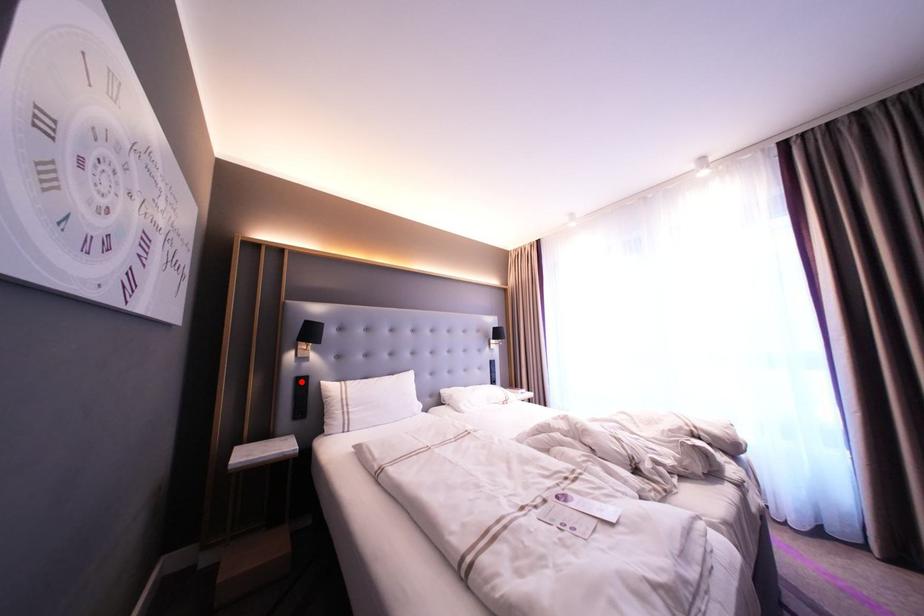
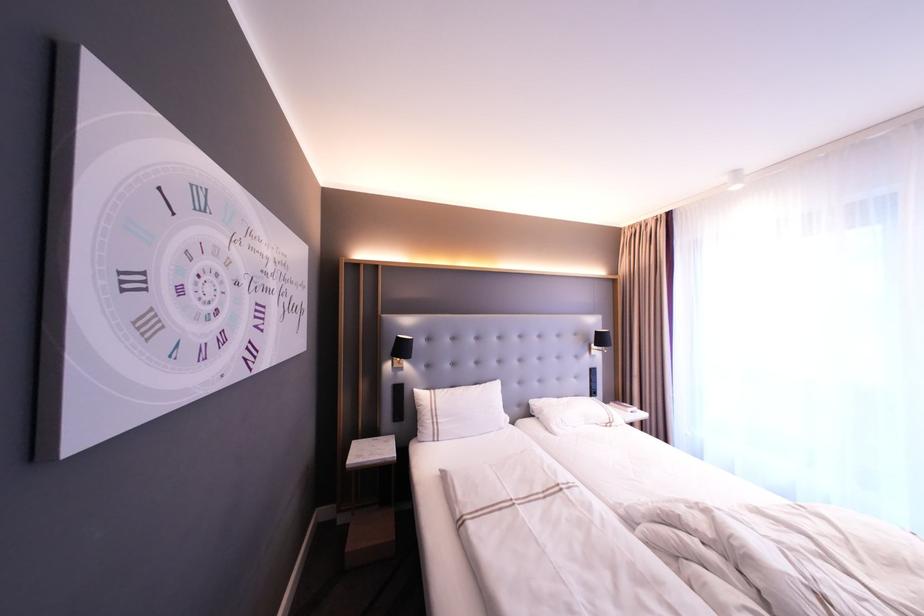
Where in the second image is the point corresponding to the highlighted location from the first image?

(397, 389)